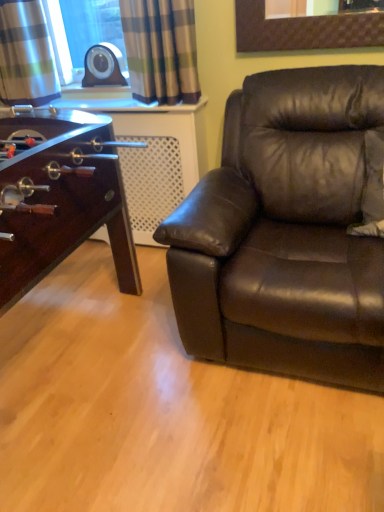
The image size is (384, 512). What do you see at coordinates (161, 50) in the screenshot? I see `plaid fabric curtain at upper left, acting as the 1th curtain starting from the right` at bounding box center [161, 50].

The height and width of the screenshot is (512, 384). Describe the element at coordinates (26, 55) in the screenshot. I see `plaid fabric curtain at upper left, the 2th curtain from the right` at that location.

What do you see at coordinates (285, 233) in the screenshot?
I see `brown leather couch at right` at bounding box center [285, 233].

What is the approximate height of brown leather couch at right?

The height of brown leather couch at right is 95.91 centimeters.

The height and width of the screenshot is (512, 384). In order to click on plaid fabric curtain at upper left, acting as the 1th curtain starting from the right in this screenshot , I will do `click(161, 50)`.

Between plaid fabric curtain at upper left, acting as the 1th curtain starting from the right, and plaid fabric curtain at upper left, the 2th curtain from the right, which one has more height?

plaid fabric curtain at upper left, the 2th curtain from the right, is taller.

From a real-world perspective, is plaid fabric curtain at upper left, acting as the 1th curtain starting from the right, physically below plaid fabric curtain at upper left, the 2th curtain from the right?

Yes, from a real-world perspective, plaid fabric curtain at upper left, acting as the 1th curtain starting from the right, is below plaid fabric curtain at upper left, the 2th curtain from the right.

Find the location of a particular element. The width and height of the screenshot is (384, 512). curtain above the plaid fabric curtain at upper left, acting as the 1th curtain starting from the right (from a real-world perspective) is located at coordinates (26, 55).

What's the angular difference between plaid fabric curtain at upper left, acting as the 1th curtain starting from the right, and plaid fabric curtain at upper left, the 2th curtain from the right,'s facing directions?

2.56 degrees separate the facing orientations of plaid fabric curtain at upper left, acting as the 1th curtain starting from the right, and plaid fabric curtain at upper left, the 2th curtain from the right.

Which object is closer to the camera taking this photo, plaid fabric curtain at upper left, positioned as the second curtain in left-to-right order, or brown leather couch at right?

brown leather couch at right.

Choose the correct answer: Is plaid fabric curtain at upper left, acting as the 1th curtain starting from the right, inside brown leather couch at right or outside it?

The correct answer is: outside.

What's the angular difference between plaid fabric curtain at upper left, positioned as the second curtain in left-to-right order, and brown leather couch at right's facing directions?

3.53 degrees separate the facing orientations of plaid fabric curtain at upper left, positioned as the second curtain in left-to-right order, and brown leather couch at right.

Does point (192, 36) come closer to viewer compared to point (170, 237)?

No, it is not.

Which point is more forward, (14, 28) or (152, 70)?

The point (152, 70) is closer to the camera.

Locate an element on the screen. This screenshot has width=384, height=512. curtain on the left of plaid fabric curtain at upper left, acting as the 1th curtain starting from the right is located at coordinates (26, 55).

How many degrees apart are the facing directions of plaid fabric curtain at upper left, which is counted as the 1th curtain, starting from the left, and plaid fabric curtain at upper left, positioned as the second curtain in left-to-right order?

There is a 2.56-degree angle between the facing directions of plaid fabric curtain at upper left, which is counted as the 1th curtain, starting from the left, and plaid fabric curtain at upper left, positioned as the second curtain in left-to-right order.

Is plaid fabric curtain at upper left, which is counted as the 1th curtain, starting from the left, bigger than plaid fabric curtain at upper left, acting as the 1th curtain starting from the right?

Yes, plaid fabric curtain at upper left, which is counted as the 1th curtain, starting from the left, is bigger than plaid fabric curtain at upper left, acting as the 1th curtain starting from the right.

Is brown leather couch at right outside of plaid fabric curtain at upper left, positioned as the second curtain in left-to-right order?

Absolutely, brown leather couch at right is external to plaid fabric curtain at upper left, positioned as the second curtain in left-to-right order.

Considering the relative positions of brown leather couch at right and plaid fabric curtain at upper left, acting as the 1th curtain starting from the right, in the image provided, is brown leather couch at right behind plaid fabric curtain at upper left, acting as the 1th curtain starting from the right,?

No, the depth of brown leather couch at right is less than that of plaid fabric curtain at upper left, acting as the 1th curtain starting from the right.

Considering the sizes of brown leather couch at right and plaid fabric curtain at upper left, acting as the 1th curtain starting from the right, in the image, is brown leather couch at right bigger or smaller than plaid fabric curtain at upper left, acting as the 1th curtain starting from the right,?

brown leather couch at right is bigger than plaid fabric curtain at upper left, acting as the 1th curtain starting from the right.

From a real-world perspective, does brown leather couch at right stand above plaid fabric curtain at upper left, acting as the 1th curtain starting from the right?

No, from a real-world perspective, brown leather couch at right is not above plaid fabric curtain at upper left, acting as the 1th curtain starting from the right.

Does brown leather couch at right have a greater height compared to plaid fabric curtain at upper left, which is counted as the 1th curtain, starting from the left?

Indeed, brown leather couch at right has a greater height compared to plaid fabric curtain at upper left, which is counted as the 1th curtain, starting from the left.

In the scene shown: Does brown leather couch at right have a smaller size compared to plaid fabric curtain at upper left, which is counted as the 1th curtain, starting from the left?

Incorrect, brown leather couch at right is not smaller in size than plaid fabric curtain at upper left, which is counted as the 1th curtain, starting from the left.

Is plaid fabric curtain at upper left, the 2th curtain from the right, a part of brown leather couch at right?

No, plaid fabric curtain at upper left, the 2th curtain from the right, is located outside of brown leather couch at right.

From the image's perspective, would you say brown leather couch at right is positioned over plaid fabric curtain at upper left, the 2th curtain from the right?

No.

Between plaid fabric curtain at upper left, the 2th curtain from the right, and brown leather couch at right, which one appears on the left side from the viewer's perspective?

Positioned to the left is plaid fabric curtain at upper left, the 2th curtain from the right.

Between plaid fabric curtain at upper left, which is counted as the 1th curtain, starting from the left, and brown leather couch at right, which one has less height?

plaid fabric curtain at upper left, which is counted as the 1th curtain, starting from the left.

In the scene shown: Can we say plaid fabric curtain at upper left, which is counted as the 1th curtain, starting from the left, lies outside brown leather couch at right?

Yes, plaid fabric curtain at upper left, which is counted as the 1th curtain, starting from the left, is not within brown leather couch at right.

Can you confirm if plaid fabric curtain at upper left, the 2th curtain from the right, is thinner than brown leather couch at right?

Indeed, plaid fabric curtain at upper left, the 2th curtain from the right, has a lesser width compared to brown leather couch at right.

Identify the location of curtain below the plaid fabric curtain at upper left, the 2th curtain from the right (from a real-world perspective). (161, 50).

Find the location of a particular element. the 1st curtain behind when counting from the brown leather couch at right is located at coordinates (161, 50).

From the image, which object appears to be nearer to plaid fabric curtain at upper left, acting as the 1th curtain starting from the right, plaid fabric curtain at upper left, the 2th curtain from the right, or brown leather couch at right?

plaid fabric curtain at upper left, the 2th curtain from the right, is closer to plaid fabric curtain at upper left, acting as the 1th curtain starting from the right.

From the image, which object appears to be nearer to plaid fabric curtain at upper left, acting as the 1th curtain starting from the right, brown leather couch at right or plaid fabric curtain at upper left, the 2th curtain from the right?

Among the two, plaid fabric curtain at upper left, the 2th curtain from the right, is located nearer to plaid fabric curtain at upper left, acting as the 1th curtain starting from the right.

Looking at the image, which one is located closer to plaid fabric curtain at upper left, the 2th curtain from the right, plaid fabric curtain at upper left, acting as the 1th curtain starting from the right, or brown leather couch at right?

plaid fabric curtain at upper left, acting as the 1th curtain starting from the right, lies closer to plaid fabric curtain at upper left, the 2th curtain from the right, than the other object.

From the image, which object appears to be farther from plaid fabric curtain at upper left, which is counted as the 1th curtain, starting from the left, brown leather couch at right or plaid fabric curtain at upper left, positioned as the second curtain in left-to-right order?

Among the two, brown leather couch at right is located further to plaid fabric curtain at upper left, which is counted as the 1th curtain, starting from the left.

Looking at the image, which one is located closer to brown leather couch at right, plaid fabric curtain at upper left, which is counted as the 1th curtain, starting from the left, or plaid fabric curtain at upper left, positioned as the second curtain in left-to-right order?

The object closer to brown leather couch at right is plaid fabric curtain at upper left, positioned as the second curtain in left-to-right order.

From the image, which object appears to be farther from brown leather couch at right, plaid fabric curtain at upper left, positioned as the second curtain in left-to-right order, or plaid fabric curtain at upper left, which is counted as the 1th curtain, starting from the left?

plaid fabric curtain at upper left, which is counted as the 1th curtain, starting from the left, is further to brown leather couch at right.

This screenshot has width=384, height=512. In order to click on curtain between plaid fabric curtain at upper left, which is counted as the 1th curtain, starting from the left, and brown leather couch at right in this screenshot , I will do `click(161, 50)`.